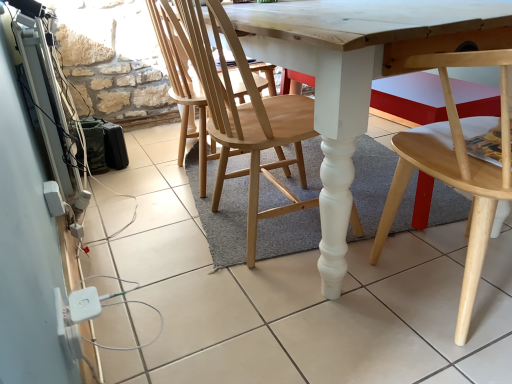
At what (x,y) coordinates should I click in order to perform the action: click on free space that is to the left of light wood chair at lower right, which is the second chair in left-to-right order. Please return your answer as a coordinate pair (x, y). Looking at the image, I should click on (334, 314).